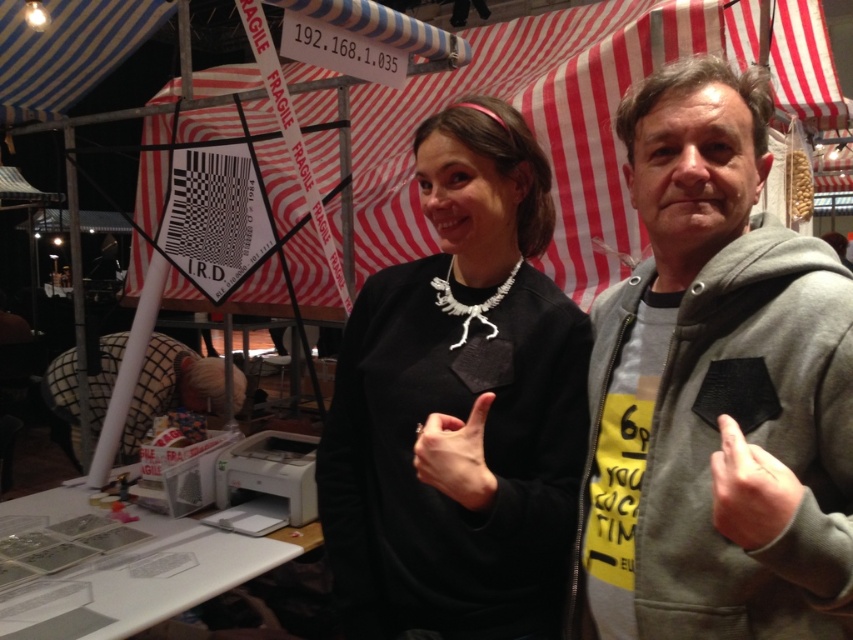
You are at the Fragile booth and need to place a 12 inch box between the black matte sweatshirt at center and the plaid fabric man at lower left. Can the box fit between them?

The black matte sweatshirt at center is smaller than the plaid fabric man at lower left, but the distance between them isn

You are a photographer standing at the booth and want to take a closeup photo of the black matte sweatshirt at center. The camera you are using has a minimum focusing distance of 1 meter. Can you take the photo without moving closer than the minimum focusing distance?

The distance of black matte sweatshirt at center from camera is 1.02 meters, so yes, you can take the photo without moving closer because the minimum focusing distance is 1 meter and the object is slightly beyond that distance.

You are a security guard at the market and need to check the items displayed on the table. You notice the black matte sweatshirt at center and the plaid fabric man at lower left. Which item is positioned higher in the image?

The black matte sweatshirt at center is located above plaid fabric man at lower left, so it is positioned higher in the image.